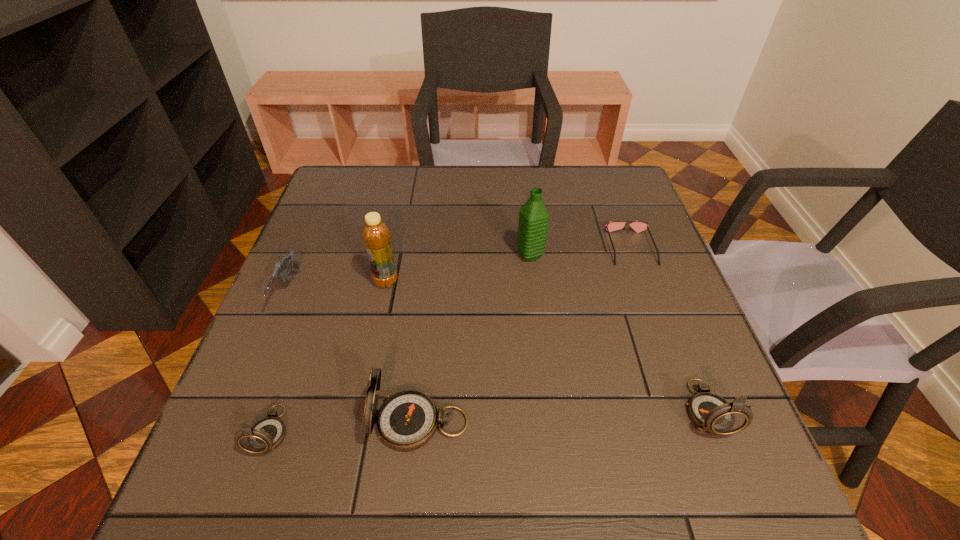
You are a GUI agent. You are given a task and a screenshot of the screen. Output one action in this format:
    pyautogui.click(x=<x>, y=<y>)
    Task: Click on the sixth object from right to left
    This screenshot has height=540, width=960.
    Given the screenshot: What is the action you would take?
    pyautogui.click(x=265, y=435)

Locate an element on the screen. This screenshot has width=960, height=540. the shortest compass is located at coordinates (265, 435).

What are the coordinates of `the tallest compass` in the screenshot? It's located at (407, 420).

Where is `the second compass from left to right`? The width and height of the screenshot is (960, 540). the second compass from left to right is located at coordinates (407, 420).

I want to click on the second tallest compass, so click(x=711, y=413).

The width and height of the screenshot is (960, 540). Find the location of `the rightmost compass`. the rightmost compass is located at coordinates (711, 413).

I want to click on bottle, so click(376, 236).

Identify the location of the leftmost object. This screenshot has height=540, width=960. (281, 268).

The width and height of the screenshot is (960, 540). In order to click on the fifth object from left to right in this screenshot , I will do click(x=533, y=217).

Where is `the shortest object`? This screenshot has height=540, width=960. the shortest object is located at coordinates (638, 226).